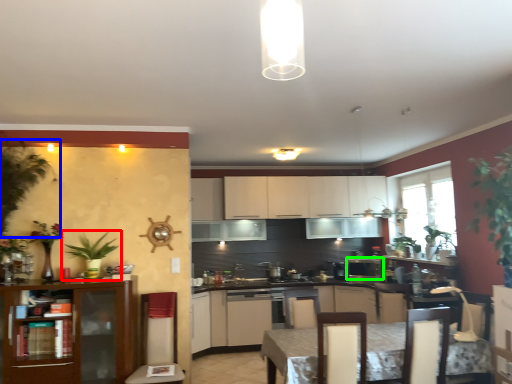
Question: Which is nearer to the houseplant (highlighted by a red box)? plant (highlighted by a blue box) or kitchen appliance (highlighted by a green box).

Choices:
 (A) plant
 (B) kitchen appliance

Answer: (A)